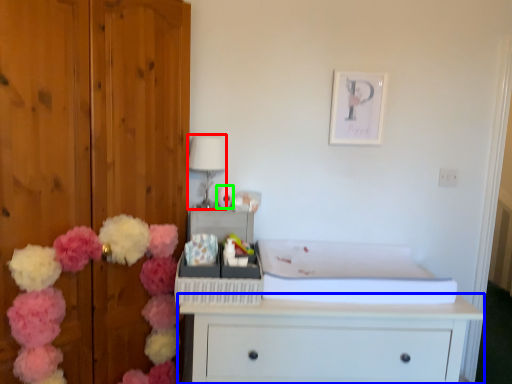
Question: Which is farther away from lamp (highlighted by a red box)? chest of drawers (highlighted by a blue box) or toy (highlighted by a green box)?

Choices:
 (A) chest of drawers
 (B) toy

Answer: (A)